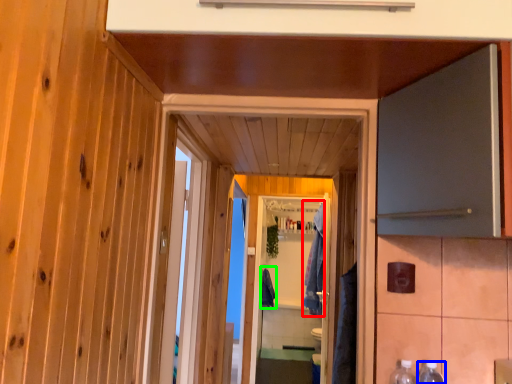
Question: Estimate the real-world distances between objects in this image. Which object is closer to robe (highlighted by a red box), bottle (highlighted by a blue box) or robe (highlighted by a green box)?

Choices:
 (A) bottle
 (B) robe

Answer: (B)